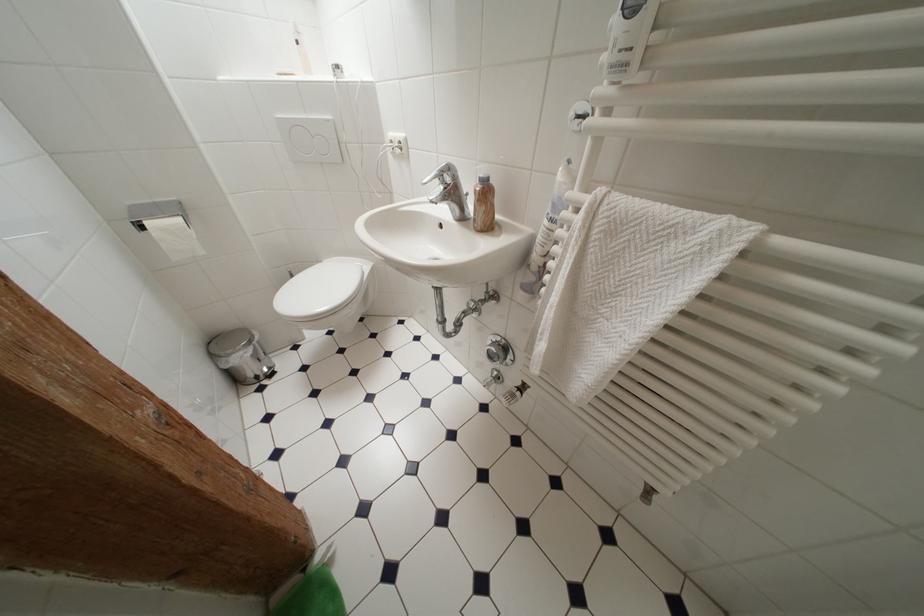
Where would you press the brown dispenser pump? Please return your answer as a coordinate pair (x, y).

(484, 205)